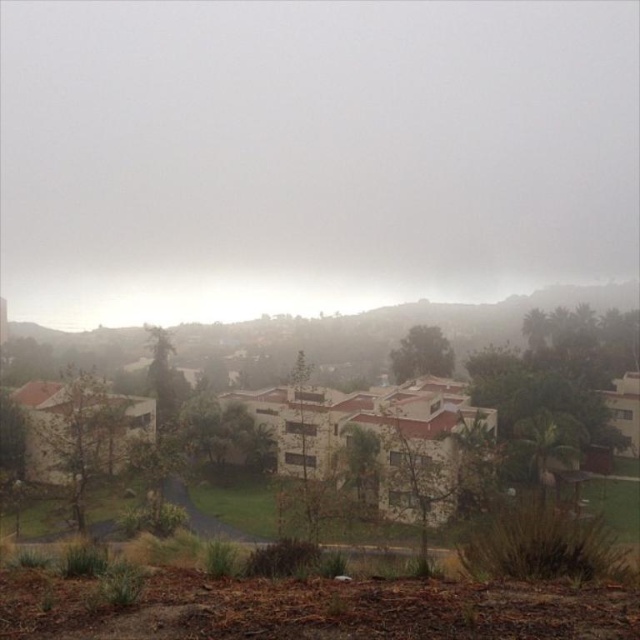
Where is `gray fog at upper center`? gray fog at upper center is located at coordinates (310, 156).

Does gray fog at upper center have a larger size compared to white stucco buildings at center?

Yes, gray fog at upper center is bigger than white stucco buildings at center.

At what (x,y) coordinates should I click in order to perform the action: click on gray fog at upper center. Please return your answer as a coordinate pair (x, y). The height and width of the screenshot is (640, 640). Looking at the image, I should click on (310, 156).